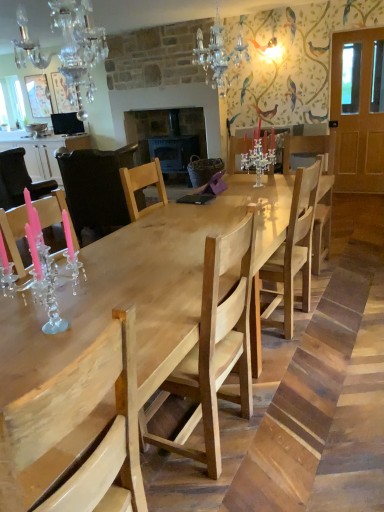
Question: Could clear crystal candelabra at center, which is counted as the third chair, starting from the back, be considered to be inside white glossy cabinet at left?

Choices:
 (A) yes
 (B) no

Answer: (B)

Question: Does white glossy cabinet at left have a greater width compared to clear crystal candelabra at center, placed as the fourth chair when sorted from front to back?

Choices:
 (A) yes
 (B) no

Answer: (A)

Question: Is white glossy cabinet at left directly adjacent to clear crystal candelabra at center, which is counted as the third chair, starting from the back?

Choices:
 (A) yes
 (B) no

Answer: (B)

Question: Is white glossy cabinet at left positioned in front of clear crystal candelabra at center, placed as the fourth chair when sorted from front to back?

Choices:
 (A) no
 (B) yes

Answer: (A)

Question: Would you consider white glossy cabinet at left to be distant from clear crystal candelabra at center, which is counted as the third chair, starting from the back?

Choices:
 (A) no
 (B) yes

Answer: (B)

Question: From a real-world perspective, relative to light wood chair at center, placed as the 2th chair when sorted from front to back, is clear crystal candelabra at center, which is counted as the third chair, starting from the back, vertically above or below?

Choices:
 (A) below
 (B) above

Answer: (B)

Question: From the image's perspective, is clear crystal candelabra at center, which is counted as the third chair, starting from the back, located above or below light wood chair at center, placed as the 2th chair when sorted from front to back?

Choices:
 (A) below
 (B) above

Answer: (B)

Question: Considering the positions of clear crystal candelabra at center, which is counted as the third chair, starting from the back, and light wood chair at center, placed as the 2th chair when sorted from front to back, in the image, is clear crystal candelabra at center, which is counted as the third chair, starting from the back, bigger or smaller than light wood chair at center, placed as the 2th chair when sorted from front to back,?

Choices:
 (A) big
 (B) small

Answer: (B)

Question: From their relative heights in the image, would you say clear crystal candelabra at center, which is counted as the third chair, starting from the back, is taller or shorter than light wood chair at center, placed as the 5th chair when sorted from back to front?

Choices:
 (A) short
 (B) tall

Answer: (A)

Question: From a real-world perspective, is natural wood table at center physically located above or below white glossy cabinet at left?

Choices:
 (A) above
 (B) below

Answer: (B)

Question: Does point (180, 309) appear closer or farther from the camera than point (48, 177)?

Choices:
 (A) closer
 (B) farther

Answer: (A)

Question: Is natural wood table at center to the left or to the right of white glossy cabinet at left in the image?

Choices:
 (A) left
 (B) right

Answer: (B)

Question: Is natural wood table at center taller or shorter than white glossy cabinet at left?

Choices:
 (A) short
 (B) tall

Answer: (A)

Question: In the image, is crystal chandelier at upper center, which is the 2th light fixture from front to back, positioned in front of or behind natural wood table at center?

Choices:
 (A) behind
 (B) front

Answer: (A)

Question: From a real-world perspective, is crystal chandelier at upper center, placed as the 1th light fixture when sorted from right to left, physically located above or below natural wood table at center?

Choices:
 (A) below
 (B) above

Answer: (B)